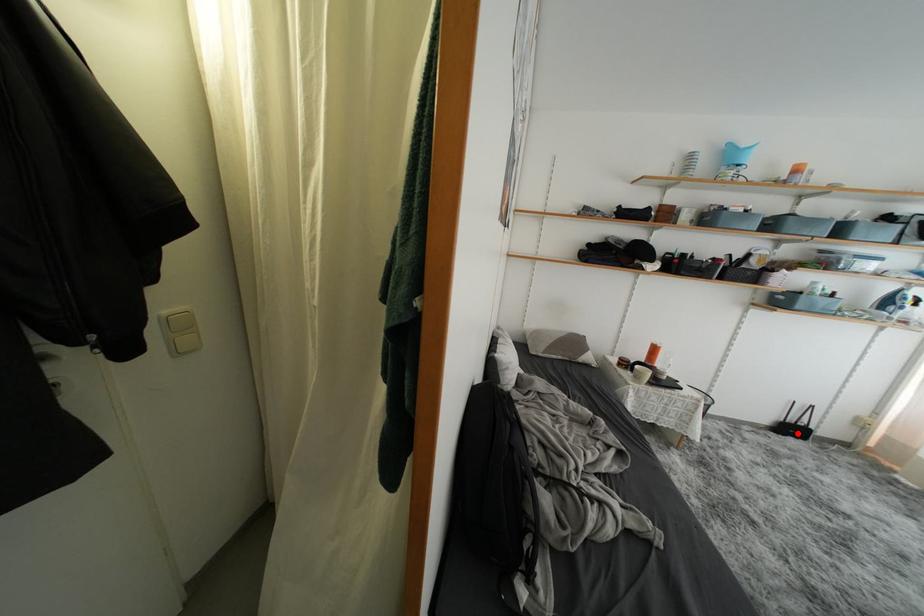
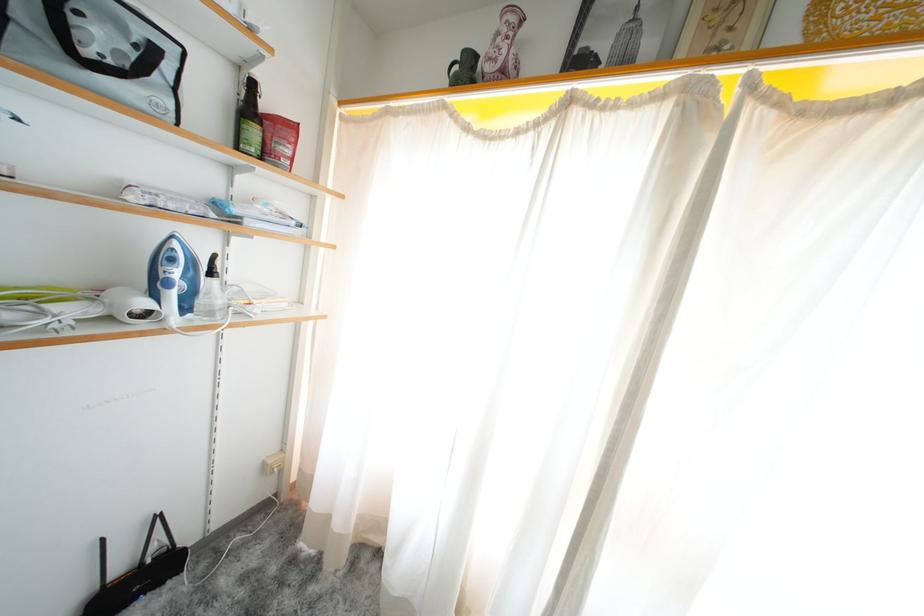
In the second image, find the point that corresponds to the highlighted location in the first image.

(143, 586)